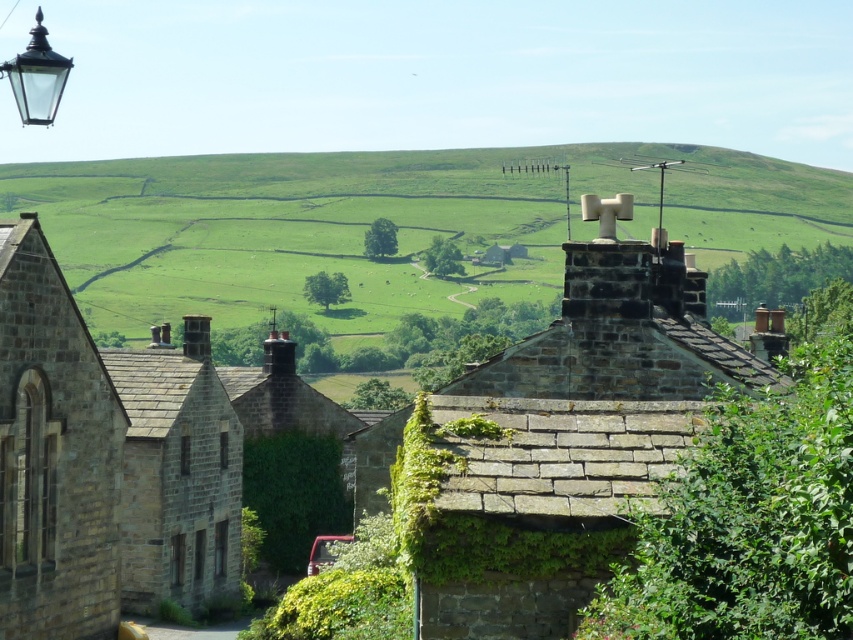
Does green grassy hillside at upper center have a larger size compared to matte glass streetlamp at upper left?

Yes.

Does green grassy hillside at upper center lie in front of matte glass streetlamp at upper left?

No.

This screenshot has height=640, width=853. Describe the element at coordinates (387, 218) in the screenshot. I see `green grassy hillside at upper center` at that location.

Where is `green grassy hillside at upper center`? Image resolution: width=853 pixels, height=640 pixels. green grassy hillside at upper center is located at coordinates (387, 218).

Can you confirm if green grassy hillside at upper center is bigger than stone chimney at center?

Yes.

Can you confirm if green grassy hillside at upper center is positioned to the right of stone chimney at center?

In fact, green grassy hillside at upper center is to the left of stone chimney at center.

Where is `green grassy hillside at upper center`? The height and width of the screenshot is (640, 853). green grassy hillside at upper center is located at coordinates (387, 218).

Is stone chimney at center below matte glass streetlamp at upper left?

Yes.

Does point (498, 500) come farther from viewer compared to point (30, 76)?

No.

This screenshot has width=853, height=640. Find the location of `stone chimney at center`. stone chimney at center is located at coordinates (575, 435).